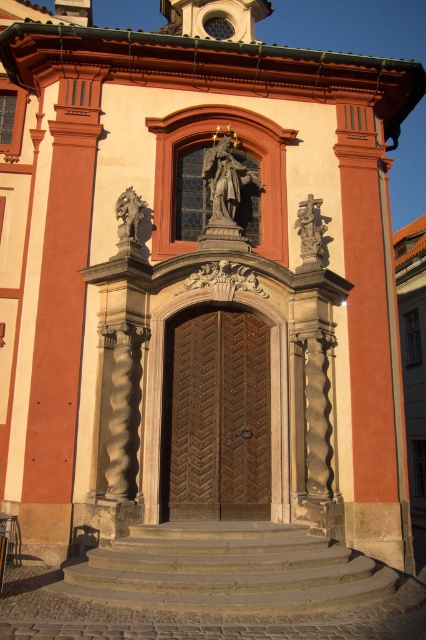
Between gray concrete stairs at center and polished stone statue at right, which one appears on the left side from the viewer's perspective?

From the viewer's perspective, gray concrete stairs at center appears more on the left side.

Where is `gray concrete stairs at center`? gray concrete stairs at center is located at coordinates (227, 570).

The image size is (426, 640). What are the coordinates of `gray concrete stairs at center` in the screenshot? It's located at (227, 570).

Is polished bronze statue at upper center smaller than matte stone statue at left?

Actually, polished bronze statue at upper center might be larger than matte stone statue at left.

Who is positioned more to the left, polished bronze statue at upper center or matte stone statue at left?

matte stone statue at left

Between point (206, 170) and point (126, 196), which one is positioned in front?

Point (126, 196)

In order to click on polished bronze statue at upper center in this screenshot , I will do `click(229, 182)`.

Is point (302, 234) more distant than point (144, 202)?

No, it is not.

Can you confirm if polished stone statue at right is positioned below matte stone statue at left?

Yes.

Is point (304, 260) more distant than point (118, 228)?

Yes, point (304, 260) is behind point (118, 228).

You are a GUI agent. You are given a task and a screenshot of the screen. Output one action in this format:
    pyautogui.click(x=<x>, y=<y>)
    Task: Click on the polished stone statue at right
    Image resolution: width=426 pixels, height=640 pixels.
    Given the screenshot: What is the action you would take?
    pyautogui.click(x=310, y=228)